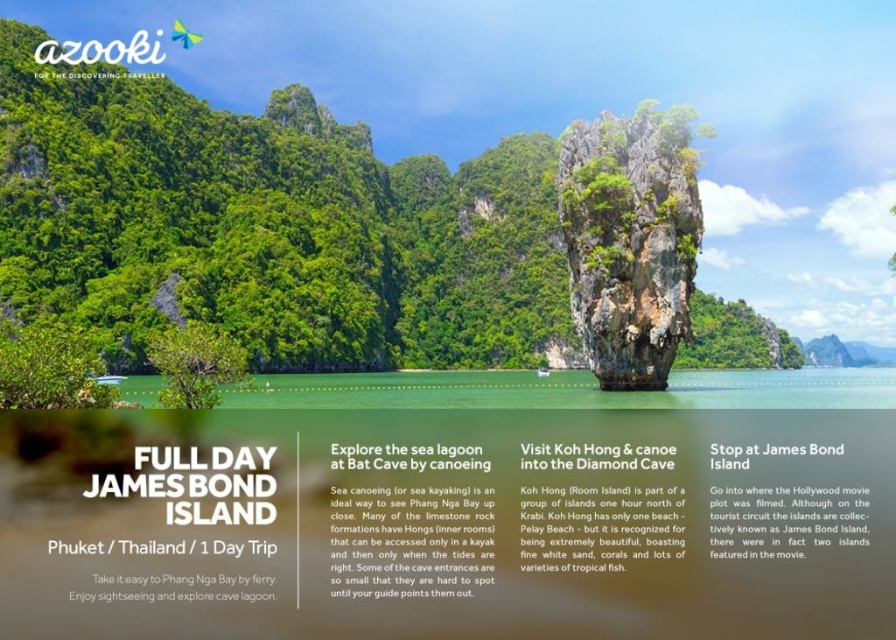
Question: Considering the real-world distances, which object is closest to the clear blue water at center?

Choices:
 (A) white paper at center
 (B) green textured rock formation at center
 (C) white paper text at right
 (D) white paper text at center

Answer: (B)

Question: Is white paper text at right above white paper at center?

Choices:
 (A) yes
 (B) no

Answer: (B)

Question: Which point is farther from the camera taking this photo?

Choices:
 (A) (756, 381)
 (B) (712, 552)
 (C) (561, 202)

Answer: (A)

Question: Considering the relative positions of green textured rock formation at center and clear blue water at center in the image provided, where is green textured rock formation at center located with respect to clear blue water at center?

Choices:
 (A) right
 (B) left

Answer: (B)

Question: Which point is farther to the camera?

Choices:
 (A) (274, 508)
 (B) (436, 400)
 (C) (610, 240)

Answer: (B)

Question: Observing the image, what is the correct spatial positioning of green textured rock formation at center in reference to white paper text at right?

Choices:
 (A) right
 (B) left

Answer: (B)